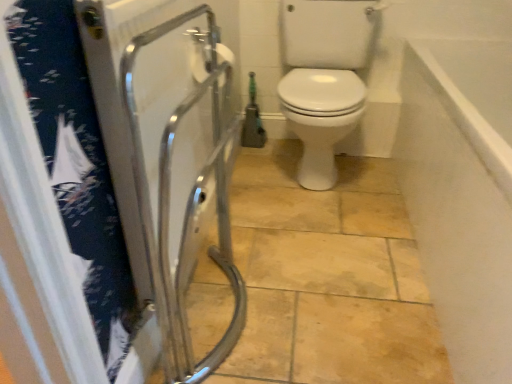
The height and width of the screenshot is (384, 512). I want to click on white matte toilet paper at upper center, so click(200, 61).

The width and height of the screenshot is (512, 384). Find the location of `transparent plastic screen door at left`. transparent plastic screen door at left is located at coordinates (164, 158).

Is point (201, 63) positioned in front of point (180, 120)?

No, (201, 63) is behind (180, 120).

Could you tell me if white matte toilet paper at upper center is turned towards transparent plastic screen door at left?

No, white matte toilet paper at upper center is not turned towards transparent plastic screen door at left.

Considering the sizes of white matte toilet paper at upper center and transparent plastic screen door at left in the image, is white matte toilet paper at upper center bigger or smaller than transparent plastic screen door at left?

Considering their sizes, white matte toilet paper at upper center takes up less space than transparent plastic screen door at left.

Is white matte toilet paper at upper center located outside transparent plastic screen door at left?

That's correct, white matte toilet paper at upper center is outside of transparent plastic screen door at left.

Is point (511, 204) positioned in front of point (179, 227)?

Yes, it is.

Would you say white smooth wall at upper right contains transparent plastic screen door at left?

That's incorrect, transparent plastic screen door at left is not inside white smooth wall at upper right.

Is white smooth wall at upper right beside transparent plastic screen door at left?

No.

How much distance is there between white smooth wall at upper right and white matte toilet paper at upper center?

white smooth wall at upper right is 34.86 inches from white matte toilet paper at upper center.

Looking at this image, can we say white smooth wall at upper right lies outside white matte toilet paper at upper center?

white smooth wall at upper right lies outside white matte toilet paper at upper center's area.

Are white smooth wall at upper right and white matte toilet paper at upper center beside each other?

white smooth wall at upper right and white matte toilet paper at upper center are clearly separated.

Find the location of a particular element. toilet paper lying on the left of white smooth wall at upper right is located at coordinates (200, 61).

Based on their sizes in the image, would you say transparent plastic screen door at left is bigger or smaller than white smooth wall at upper right?

Considering their sizes, transparent plastic screen door at left takes up less space than white smooth wall at upper right.

Is transparent plastic screen door at left oriented towards white smooth wall at upper right?

Yes, transparent plastic screen door at left is facing white smooth wall at upper right.

From a real-world perspective, is transparent plastic screen door at left physically located above or below white smooth wall at upper right?

transparent plastic screen door at left is situated higher than white smooth wall at upper right in the real world.

From the picture: Are transparent plastic screen door at left and white smooth wall at upper right beside each other?

No, transparent plastic screen door at left is not in contact with white smooth wall at upper right.

Considering the relative sizes of transparent plastic screen door at left and white matte toilet paper at upper center in the image provided, is transparent plastic screen door at left bigger than white matte toilet paper at upper center?

Yes.

Looking at this image, which is closer, (165,331) or (204,79)?

The point (165,331) is closer.

Is transparent plastic screen door at left not inside white matte toilet paper at upper center?

transparent plastic screen door at left is positioned outside white matte toilet paper at upper center.

From the image's perspective, is transparent plastic screen door at left above white matte toilet paper at upper center?

No, from the image's perspective, transparent plastic screen door at left is not on top of white matte toilet paper at upper center.

Is white matte toilet paper at upper center aimed at white smooth wall at upper right?

Yes.

Would you say white smooth wall at upper right is part of white matte toilet paper at upper center's contents?

No, white smooth wall at upper right is not inside white matte toilet paper at upper center.

Considering the sizes of white matte toilet paper at upper center and white smooth wall at upper right in the image, is white matte toilet paper at upper center bigger or smaller than white smooth wall at upper right?

white matte toilet paper at upper center is smaller than white smooth wall at upper right.

Between white matte toilet paper at upper center and white smooth wall at upper right, which one has more height?

white smooth wall at upper right.

You are a GUI agent. You are given a task and a screenshot of the screen. Output one action in this format:
    pyautogui.click(x=<x>, y=<y>)
    Task: Click on the toilet paper above the transparent plastic screen door at left (from a real-world perspective)
    
    Given the screenshot: What is the action you would take?
    pyautogui.click(x=200, y=61)

The height and width of the screenshot is (384, 512). Find the location of `bath on the right of transparent plastic screen door at left`. bath on the right of transparent plastic screen door at left is located at coordinates (458, 215).

Considering their positions, is white smooth wall at upper right positioned closer to white matte toilet paper at upper center than transparent plastic screen door at left?

Based on the image, transparent plastic screen door at left appears to be nearer to white matte toilet paper at upper center.

Estimate the real-world distances between objects in this image. Which object is further from transparent plastic screen door at left, white smooth wall at upper right or white matte toilet paper at upper center?

white smooth wall at upper right is positioned further to the anchor transparent plastic screen door at left.

Which object lies further to the anchor point white smooth wall at upper right, transparent plastic screen door at left or white matte toilet paper at upper center?

white matte toilet paper at upper center.

Based on their spatial positions, is transparent plastic screen door at left or white smooth wall at upper right closer to white matte toilet paper at upper center?

transparent plastic screen door at left.

Consider the image. Which object lies nearer to the anchor point transparent plastic screen door at left, white matte toilet paper at upper center or white smooth wall at upper right?

white matte toilet paper at upper center.

Looking at the image, which one is located closer to white smooth wall at upper right, white matte toilet paper at upper center or transparent plastic screen door at left?

Among the two, transparent plastic screen door at left is located nearer to white smooth wall at upper right.

Identify the location of screen door situated between white matte toilet paper at upper center and white smooth wall at upper right from left to right. The width and height of the screenshot is (512, 384). (164, 158).